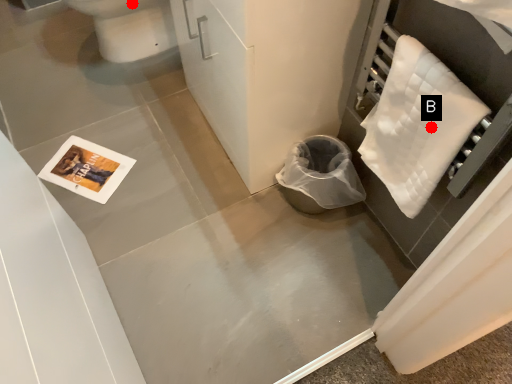
Question: Two points are circled on the image, labeled by A and B beside each circle. Which of the following is the closest to the observer?

Choices:
 (A) A is closer
 (B) B is closer

Answer: (B)